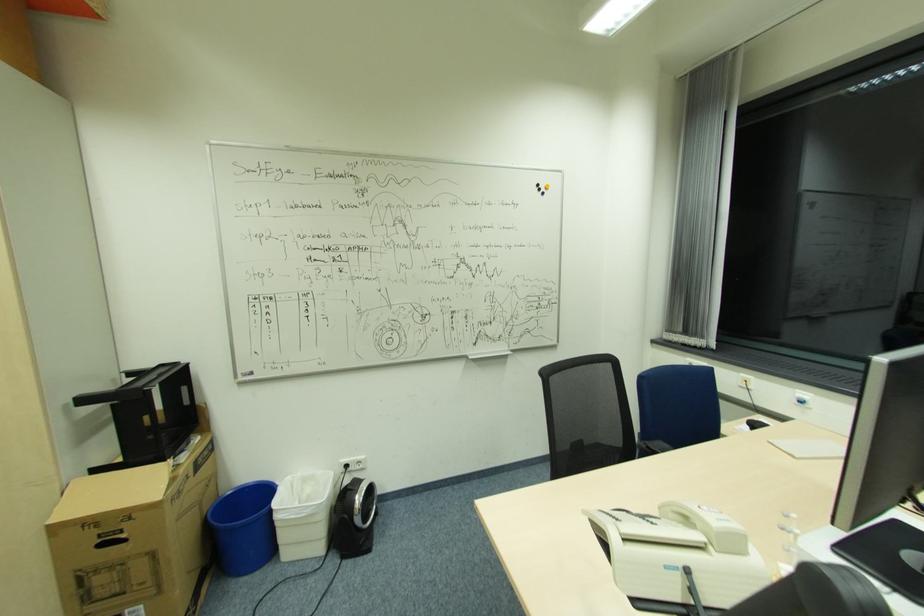
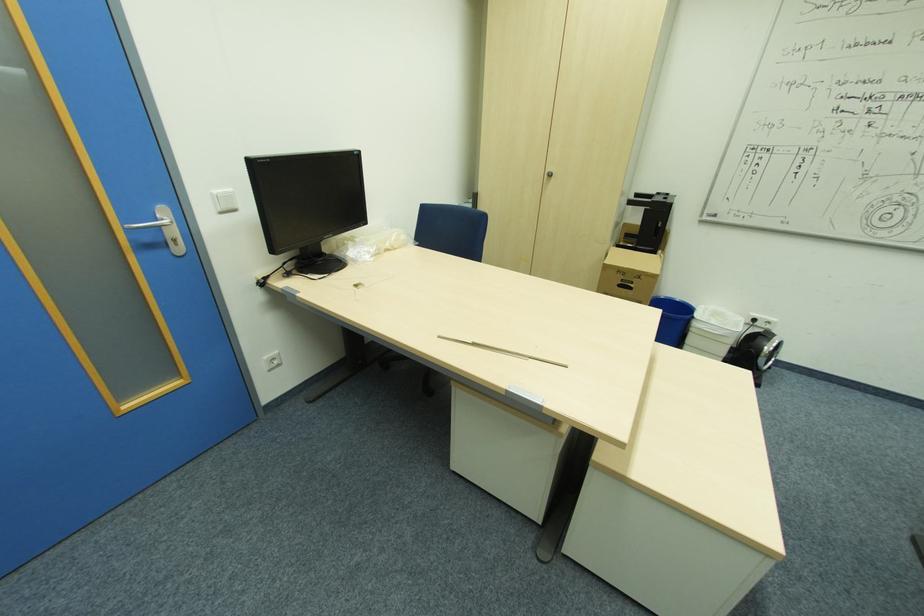
Find the pixel in the second image that matches point (131, 517) in the first image.

(641, 277)